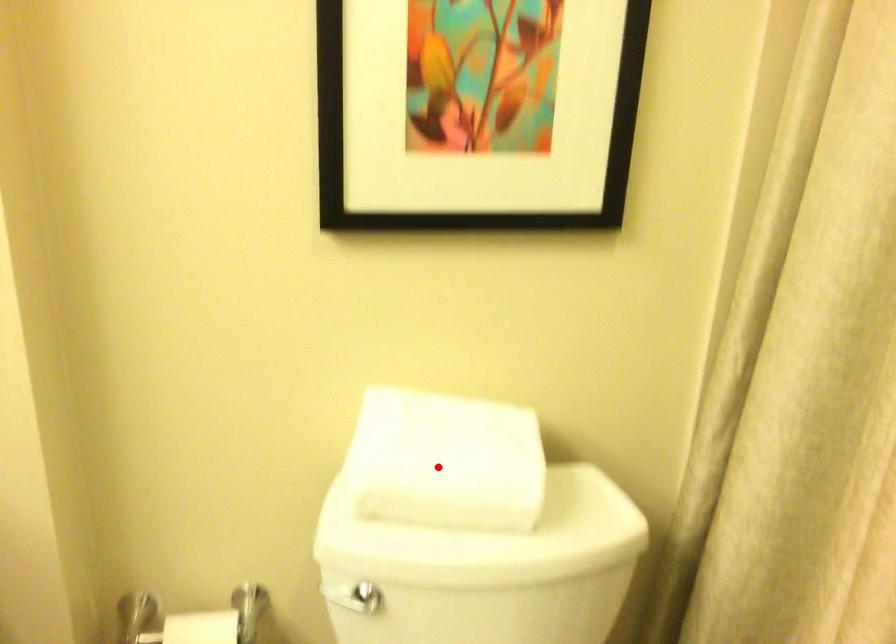
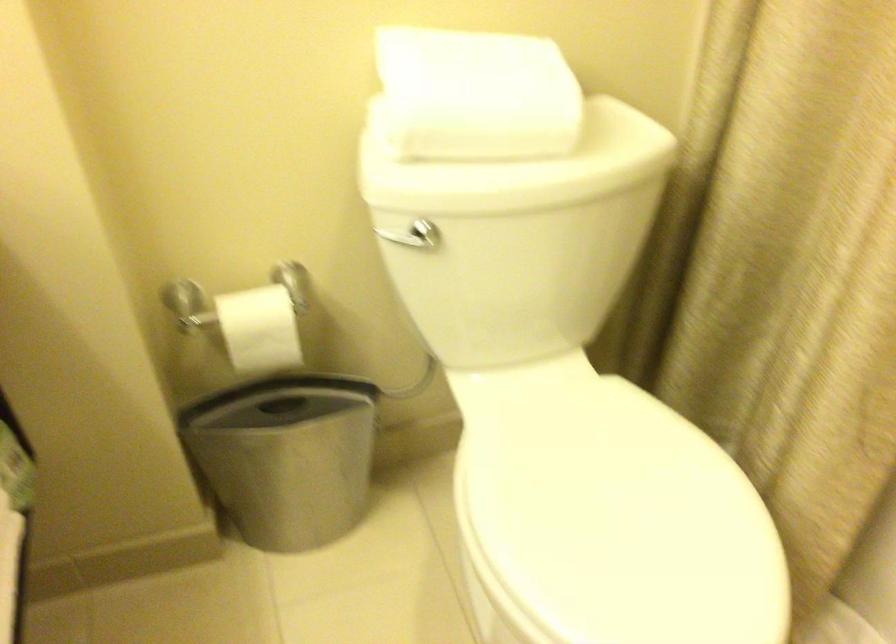
The point at the highlighted location is marked in the first image. Where is the corresponding point in the second image?

(476, 95)